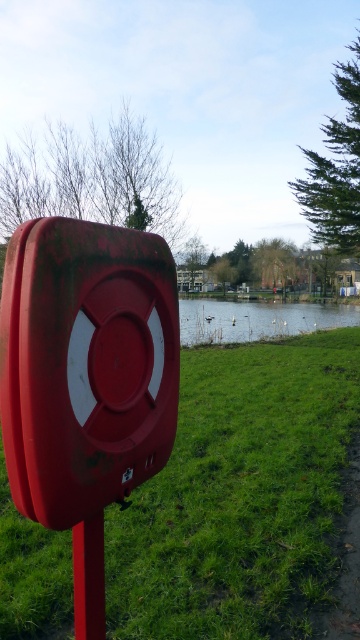
Where is `rusty plastic lifebuoy at center`? This screenshot has height=640, width=360. rusty plastic lifebuoy at center is located at coordinates (86, 365).

Can you confirm if rusty plastic lifebuoy at center is positioned to the right of green grassy water at center?

Incorrect, rusty plastic lifebuoy at center is not on the right side of green grassy water at center.

Is point (162, 376) positioned in front of point (219, 314)?

Yes.

Find the location of a particular element. The height and width of the screenshot is (640, 360). rusty plastic lifebuoy at center is located at coordinates (86, 365).

Which is behind, point (286, 624) or point (218, 305)?

Point (218, 305)

Locate an element on the screen. green grassy at center is located at coordinates (240, 496).

Between green grassy water at center and smooth glossy red pole at lower left, which one is positioned lower?

Positioned lower is smooth glossy red pole at lower left.

Who is shorter, green grassy water at center or smooth glossy red pole at lower left?

smooth glossy red pole at lower left

Which is behind, point (249, 321) or point (96, 630)?

Point (249, 321)

This screenshot has height=640, width=360. Identify the location of green grassy water at center. (257, 320).